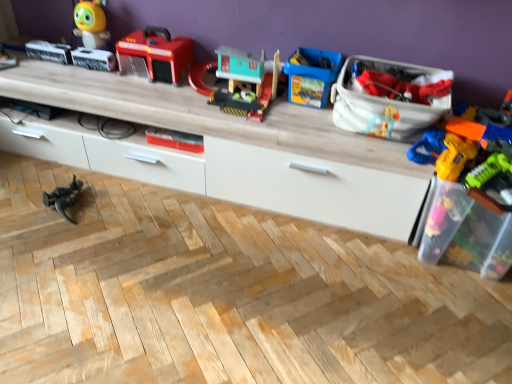
The width and height of the screenshot is (512, 384). Find the location of `free area below black plastic dinosaur at lower left, which is the first toy from left to right (from a real-world perspective)`. free area below black plastic dinosaur at lower left, which is the first toy from left to right (from a real-world perspective) is located at coordinates (72, 201).